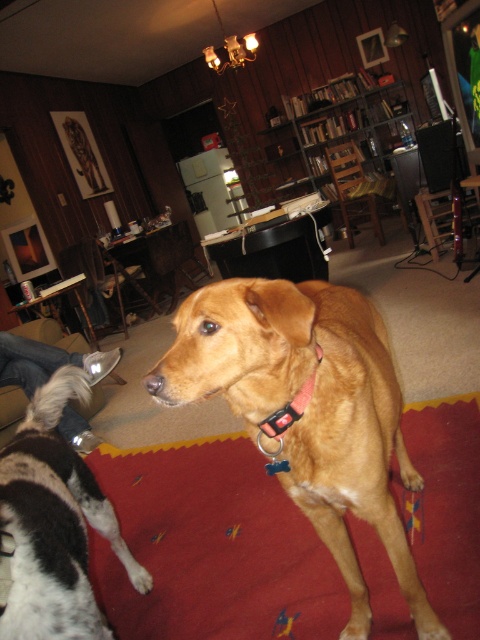
Question: Does golden fur dog at center appear over white fur at lower left?

Choices:
 (A) yes
 (B) no

Answer: (A)

Question: Which object is closer to the camera taking this photo?

Choices:
 (A) brown fur dog at center
 (B) golden fur dog at center
 (C) white fur at lower left
 (D) red fabric collar at center

Answer: (B)

Question: Can you confirm if brown fur dog at center is bigger than white fur at lower left?

Choices:
 (A) yes
 (B) no

Answer: (A)

Question: Which of the following is the closest to the observer?

Choices:
 (A) (277, 422)
 (B) (319, 308)
 (C) (99, 355)

Answer: (A)

Question: Is brown fur dog at center further to camera compared to white fur at lower left?

Choices:
 (A) no
 (B) yes

Answer: (A)

Question: Which of the following is the closest to the observer?

Choices:
 (A) (304, 396)
 (B) (393, 371)
 (C) (72, 570)

Answer: (A)